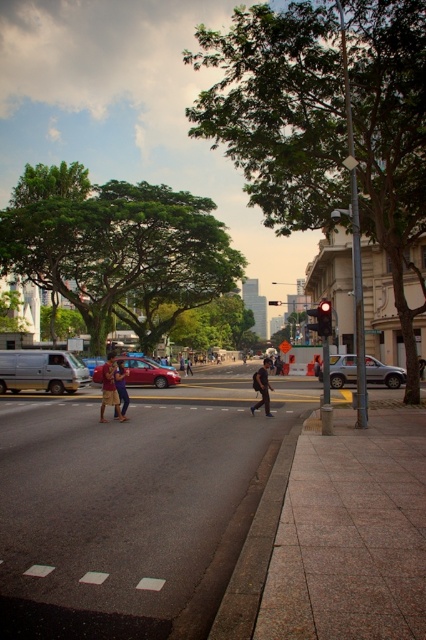
Question: Is green leafy tree at upper left positioned at the back of silver metallic van at left?

Choices:
 (A) yes
 (B) no

Answer: (A)

Question: Which object is the farthest from the matte red car at center?

Choices:
 (A) satin silver sedan at center-right
 (B) denim shorts at center
 (C) green leafy tree at upper left
 (D) paved concrete sidewalk at lower right

Answer: (B)

Question: Which of these objects is positioned closest to the denim shorts at center?

Choices:
 (A) green leafy tree at center
 (B) matte red car at center

Answer: (B)

Question: Does matte brown backpack at center have a greater width compared to dark blue jeans at center?

Choices:
 (A) yes
 (B) no

Answer: (A)

Question: Is silver metallic van at left above dark brown backpack at center?

Choices:
 (A) no
 (B) yes

Answer: (B)

Question: Considering the real-world distances, which object is closest to the green leafy tree at center?

Choices:
 (A) paved concrete sidewalk at lower right
 (B) dark brown backpack at center
 (C) denim shorts at center

Answer: (A)